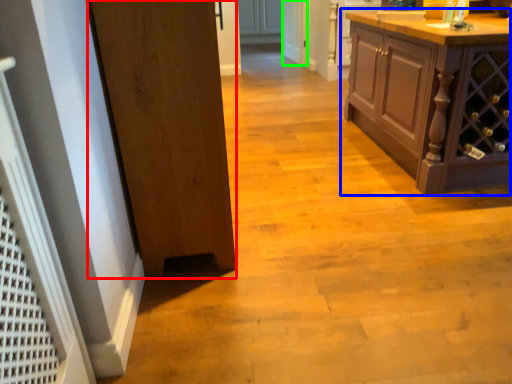
Question: Considering the real-world distances, which object is closest to door (highlighted by a red box)? cabinetry (highlighted by a blue box) or screen door (highlighted by a green box).

Choices:
 (A) cabinetry
 (B) screen door

Answer: (A)